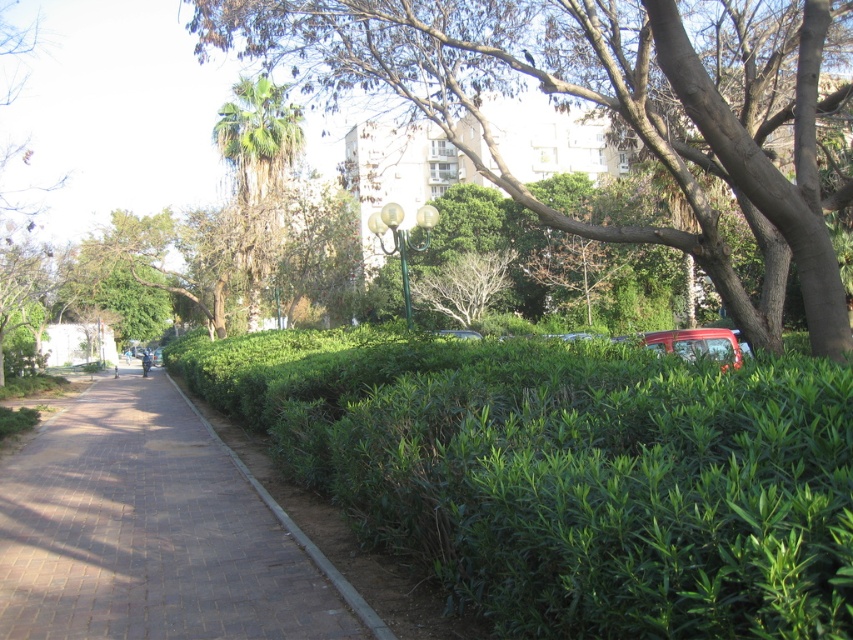
Who is more distant from viewer, (x=766, y=490) or (x=465, y=35)?

The point (x=465, y=35) is behind.

Is green leafy hedge at center below green leafy tree at center?

Yes.

Describe the element at coordinates (566, 474) in the screenshot. I see `green leafy hedge at center` at that location.

I want to click on green leafy hedge at center, so click(x=566, y=474).

Which is more to the left, green leafy hedge at center or green leafy palm tree at center?

green leafy palm tree at center

Is green leafy hedge at center positioned at the back of green leafy palm tree at center?

No, green leafy hedge at center is in front of green leafy palm tree at center.

Between point (431, 364) and point (289, 122), which one is positioned behind?

The point (289, 122) is behind.

I want to click on green leafy hedge at center, so click(x=566, y=474).

Does green leafy hedge at center have a lesser height compared to metallic red car at right?

In fact, green leafy hedge at center may be taller than metallic red car at right.

Who is more forward, (848, 531) or (701, 355)?

Point (848, 531) is more forward.

At what (x,y) coordinates should I click in order to perform the action: click on green leafy hedge at center. Please return your answer as a coordinate pair (x, y). Looking at the image, I should click on (566, 474).